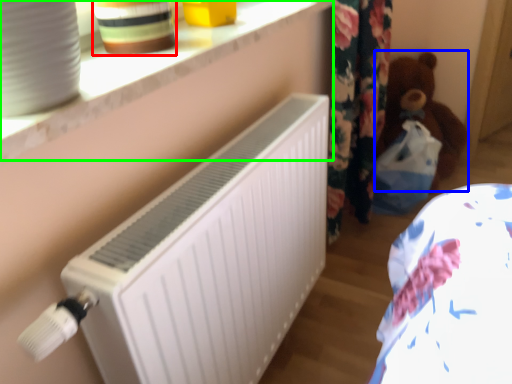
Question: Based on their relative distances, which object is farther from pottery (highlighted by a red box)? Choose from teddy (highlighted by a blue box) and window sill (highlighted by a green box).

Choices:
 (A) teddy
 (B) window sill

Answer: (A)